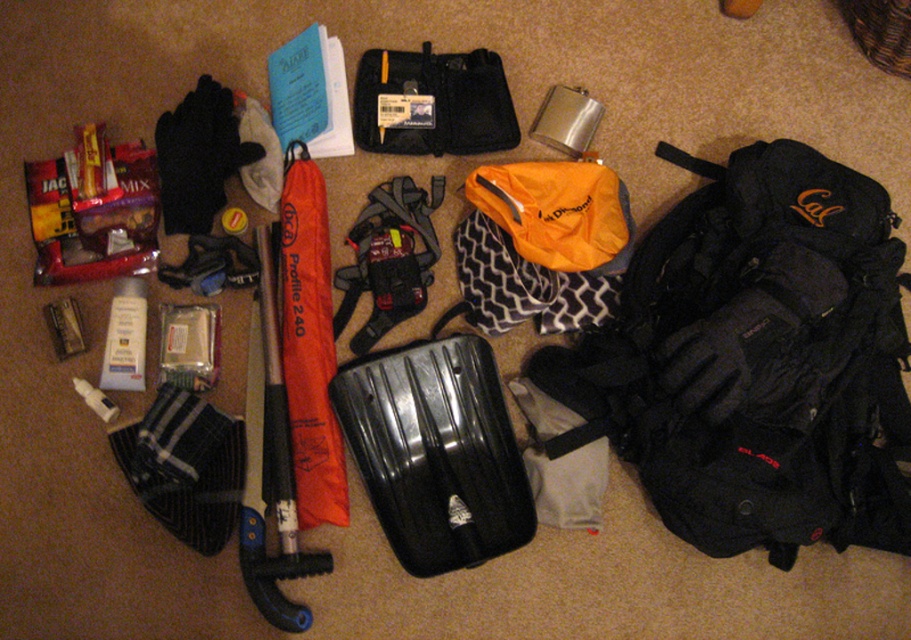
Consider the image. Between matte black backpack at right and black fabric case at center, which one appears on the right side from the viewer's perspective?

matte black backpack at right is more to the right.

Which is in front, point (677, 264) or point (415, 60)?

Positioned in front is point (677, 264).

The height and width of the screenshot is (640, 911). What do you see at coordinates (756, 360) in the screenshot? I see `matte black backpack at right` at bounding box center [756, 360].

The height and width of the screenshot is (640, 911). Find the location of `matte black backpack at right`. matte black backpack at right is located at coordinates (756, 360).

Which is more to the right, matte black backpack at right or black hard shell suitcase at center?

matte black backpack at right

Where is `matte black backpack at right`? This screenshot has width=911, height=640. matte black backpack at right is located at coordinates 756,360.

Find the location of a particular element. The width and height of the screenshot is (911, 640). matte black backpack at right is located at coordinates (756, 360).

Who is positioned more to the left, matte black backpack at right or orange fabric umbrella at center-left?

From the viewer's perspective, orange fabric umbrella at center-left appears more on the left side.

Is point (745, 196) positioned behind point (285, 605)?

That is True.

Where is `matte black backpack at right`? This screenshot has height=640, width=911. matte black backpack at right is located at coordinates (756, 360).